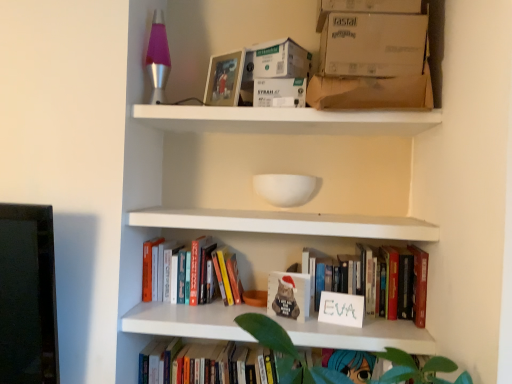
Describe the element at coordinates (157, 269) in the screenshot. I see `hardcover books at center, marked as the first book in a top-to-bottom arrangement` at that location.

What do you see at coordinates (279, 92) in the screenshot? The width and height of the screenshot is (512, 384). I see `white cardboard box at upper center` at bounding box center [279, 92].

Where is `white matte sign at center, marked as the 2th book in a bottom-to-top arrangement`? white matte sign at center, marked as the 2th book in a bottom-to-top arrangement is located at coordinates (406, 283).

Describe the element at coordinates (277, 60) in the screenshot. This screenshot has height=384, width=512. I see `white cardboard box at upper center, the 1th cardboard box from the top` at that location.

The height and width of the screenshot is (384, 512). I want to click on hardcover books at center, marked as the first book in a top-to-bottom arrangement, so coord(157,269).

Is brown cardboard box at upper center, the third cardboard box viewed from the top, not inside matte plastic picture frame at upper center?

Yes, brown cardboard box at upper center, the third cardboard box viewed from the top, is not within matte plastic picture frame at upper center.

Considering the relative sizes of brown cardboard box at upper center, the third cardboard box viewed from the top, and matte plastic picture frame at upper center in the image provided, is brown cardboard box at upper center, the third cardboard box viewed from the top, bigger than matte plastic picture frame at upper center?

Yes, brown cardboard box at upper center, the third cardboard box viewed from the top, is bigger than matte plastic picture frame at upper center.

In the image, is brown cardboard box at upper center, the third cardboard box viewed from the top, positioned in front of or behind matte plastic picture frame at upper center?

brown cardboard box at upper center, the third cardboard box viewed from the top, is positioned closer to the viewer than matte plastic picture frame at upper center.

Does point (423, 19) appear closer or farther from the camera than point (236, 353)?

Clearly, point (423, 19) is closer to the camera than point (236, 353).

Considering the sizes of objects white cardboard box at upper right, the second cardboard box positioned from the bottom, and hardcover book at lower center, marked as the 1th book in a bottom-to-top arrangement, in the image provided, who is bigger, white cardboard box at upper right, the second cardboard box positioned from the bottom, or hardcover book at lower center, marked as the 1th book in a bottom-to-top arrangement,?

Bigger between the two is hardcover book at lower center, marked as the 1th book in a bottom-to-top arrangement.

Is white cardboard box at upper right, the second cardboard box positioned from the bottom, in front of hardcover book at lower center, marked as the 1th book in a bottom-to-top arrangement?

Yes, the depth of white cardboard box at upper right, the second cardboard box positioned from the bottom, is less than that of hardcover book at lower center, marked as the 1th book in a bottom-to-top arrangement.

Is the surface of white matte shelf at upper center in direct contact with hardcover books at center, marked as the first book in a top-to-bottom arrangement?

No, white matte shelf at upper center is not with hardcover books at center, marked as the first book in a top-to-bottom arrangement.

Is hardcover books at center, marked as the first book in a top-to-bottom arrangement, at the back of white matte shelf at upper center?

No, white matte shelf at upper center is not facing away from hardcover books at center, marked as the first book in a top-to-bottom arrangement.

In the scene shown: From the image's perspective, is white matte shelf at upper center located beneath hardcover books at center, marked as the first book in a top-to-bottom arrangement?

No, from the image's perspective, white matte shelf at upper center is not below hardcover books at center, marked as the first book in a top-to-bottom arrangement.

Can you see white cardboard box at upper center, the 3th cardboard box positioned from the bottom, touching white matte sign at center, which is counted as the 2th book, starting from the top?

No, white cardboard box at upper center, the 3th cardboard box positioned from the bottom, is not in contact with white matte sign at center, which is counted as the 2th book, starting from the top.

Looking at this image, from the image's perspective, between white cardboard box at upper center, the 1th cardboard box from the top, and white matte sign at center, which is counted as the 2th book, starting from the top, who is located below?

From the image's view, white matte sign at center, which is counted as the 2th book, starting from the top, is below.

Is white cardboard box at upper center, the 3th cardboard box positioned from the bottom, facing away from white matte sign at center, marked as the 2th book in a bottom-to-top arrangement?

white cardboard box at upper center, the 3th cardboard box positioned from the bottom, does not have its back to white matte sign at center, marked as the 2th book in a bottom-to-top arrangement.

Which is more to the right, white cardboard box at upper center, the 3th cardboard box positioned from the bottom, or white matte sign at center, which is counted as the 2th book, starting from the top?

white matte sign at center, which is counted as the 2th book, starting from the top.

From their relative heights in the image, would you say hardcover books at center, marked as the first book in a top-to-bottom arrangement, is taller or shorter than white matte shelf at upper center?

In the image, hardcover books at center, marked as the first book in a top-to-bottom arrangement, appears to be taller than white matte shelf at upper center.

Find the location of a particular element. The width and height of the screenshot is (512, 384). book that is the 1st object directly below the white matte shelf at upper center (from a real-world perspective) is located at coordinates (157, 269).

From a real-world perspective, is hardcover books at center, marked as the first book in a top-to-bottom arrangement, above or below white matte shelf at upper center?

From a real-world perspective, hardcover books at center, marked as the first book in a top-to-bottom arrangement, is physically below white matte shelf at upper center.

Which object is wider, hardcover books at center, acting as the 3th book starting from the bottom, or white matte shelf at upper center?

Wider between the two is white matte shelf at upper center.

From the image's perspective, starting from the brown cardboard box at upper center, which is the first cardboard box in bottom-to-top order, which book is the 2nd one below? Please provide its 2D coordinates.

[(406, 283)]

Considering the sizes of objects white matte sign at center, which is counted as the 2th book, starting from the top, and brown cardboard box at upper center, the third cardboard box viewed from the top, in the image provided, who is shorter, white matte sign at center, which is counted as the 2th book, starting from the top, or brown cardboard box at upper center, the third cardboard box viewed from the top,?

With less height is brown cardboard box at upper center, the third cardboard box viewed from the top.

From the image's perspective, which one is positioned lower, white matte sign at center, marked as the 2th book in a bottom-to-top arrangement, or brown cardboard box at upper center, which is the first cardboard box in bottom-to-top order?

white matte sign at center, marked as the 2th book in a bottom-to-top arrangement, is shown below in the image.

Is white matte sign at center, which is counted as the 2th book, starting from the top, looking in the opposite direction of brown cardboard box at upper center, which is the first cardboard box in bottom-to-top order?

That's not correct — white matte sign at center, which is counted as the 2th book, starting from the top, is not looking away from brown cardboard box at upper center, which is the first cardboard box in bottom-to-top order.

Does white matte shelf at upper center have a lesser height compared to white matte sign at center, marked as the 2th book in a bottom-to-top arrangement?

Correct, white matte shelf at upper center is not as tall as white matte sign at center, marked as the 2th book in a bottom-to-top arrangement.

Is white matte shelf at upper center looking in the opposite direction of white matte sign at center, marked as the 2th book in a bottom-to-top arrangement?

That's not correct — white matte shelf at upper center is not looking away from white matte sign at center, marked as the 2th book in a bottom-to-top arrangement.

Considering the sizes of objects white matte shelf at upper center and white matte sign at center, marked as the 2th book in a bottom-to-top arrangement, in the image provided, who is wider, white matte shelf at upper center or white matte sign at center, marked as the 2th book in a bottom-to-top arrangement,?

white matte shelf at upper center is wider.

Which is nearer, (214, 118) or (394, 251)?

Clearly, point (214, 118) is closer to the camera than point (394, 251).

This screenshot has width=512, height=384. In order to click on picture frame located on the left of brown cardboard box at upper center, the third cardboard box viewed from the top in this screenshot , I will do `click(224, 79)`.

From a real-world perspective, count 3rd books downward from the white cardboard box at upper right, the second cardboard box positioned from the bottom, and point to it. Please provide its 2D coordinates.

[(189, 361)]

Looking at the image, which one is located further to white matte sign at center, which is counted as the 2th book, starting from the top, matte plastic picture frame at upper center or white cardboard box at upper right, the 2th cardboard box in the top-to-bottom sequence?

matte plastic picture frame at upper center is positioned further to the anchor white matte sign at center, which is counted as the 2th book, starting from the top.

Looking at the image, which one is located closer to white cardboard box at upper right, the 2th cardboard box in the top-to-bottom sequence, brown cardboard box at upper center, the third cardboard box viewed from the top, or white matte sign at center, which is counted as the 2th book, starting from the top?

brown cardboard box at upper center, the third cardboard box viewed from the top, is closer to white cardboard box at upper right, the 2th cardboard box in the top-to-bottom sequence.

From the image, which object appears to be nearer to matte plastic picture frame at upper center, white cardboard box at upper center or white cardboard box at upper center, the 3th cardboard box positioned from the bottom?

white cardboard box at upper center, the 3th cardboard box positioned from the bottom, lies closer to matte plastic picture frame at upper center than the other object.

From the image, which object appears to be farther from hardcover books at center, marked as the first book in a top-to-bottom arrangement, hardcover book at lower center, which is the 3th book in top-to-bottom order, or white matte shelf at upper center?

white matte shelf at upper center is positioned further to the anchor hardcover books at center, marked as the first book in a top-to-bottom arrangement.

Looking at the image, which one is located closer to brown cardboard box at upper center, the third cardboard box viewed from the top, matte plastic picture frame at upper center or white cardboard box at upper right, the second cardboard box positioned from the bottom?

white cardboard box at upper right, the second cardboard box positioned from the bottom, lies closer to brown cardboard box at upper center, the third cardboard box viewed from the top, than the other object.

Which object lies nearer to the anchor point white matte shelf at upper center, hardcover books at center, marked as the first book in a top-to-bottom arrangement, or matte plastic picture frame at upper center?

Based on the image, matte plastic picture frame at upper center appears to be nearer to white matte shelf at upper center.

From the image, which object appears to be farther from white matte shelf at upper center, brown cardboard box at upper center, which is the first cardboard box in bottom-to-top order, or white cardboard box at upper center, the 3th cardboard box positioned from the bottom?

The object further to white matte shelf at upper center is white cardboard box at upper center, the 3th cardboard box positioned from the bottom.

When comparing their distances from brown cardboard box at upper center, the third cardboard box viewed from the top, does hardcover books at center, marked as the first book in a top-to-bottom arrangement, or hardcover book at lower center, marked as the 1th book in a bottom-to-top arrangement, seem closer?

The object closer to brown cardboard box at upper center, the third cardboard box viewed from the top, is hardcover books at center, marked as the first book in a top-to-bottom arrangement.

The width and height of the screenshot is (512, 384). I want to click on storage box between matte plastic picture frame at upper center and matte white book at center vertically, so click(x=279, y=92).

At what (x,y) coordinates should I click in order to perform the action: click on shelf that lies between matte plastic picture frame at upper center and hardcover book at lower center, marked as the 1th book in a bottom-to-top arrangement, from top to bottom. Please return your answer as a coordinate pair (x, y). Image resolution: width=512 pixels, height=384 pixels. Looking at the image, I should click on (284, 120).

Identify the location of storage box between white cardboard box at upper center, the 3th cardboard box positioned from the bottom, and matte white book at center in the up-down direction. (279, 92).

Locate an element on the screen. This screenshot has width=512, height=384. storage box between white cardboard box at upper center, the 1th cardboard box from the top, and white cardboard box at upper right, the second cardboard box positioned from the bottom, in the horizontal direction is located at coordinates (279, 92).